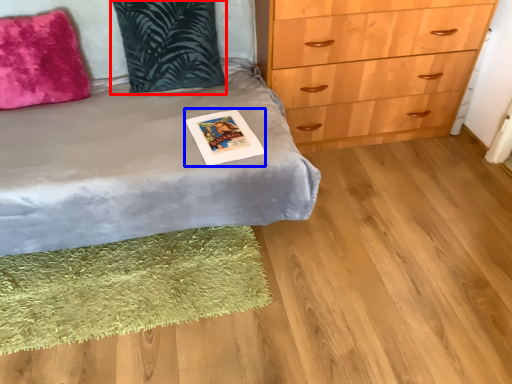
Question: Which point is closer to the camera, pillow (highlighted by a red box) or postcard (highlighted by a blue box)?

Choices:
 (A) pillow
 (B) postcard

Answer: (B)